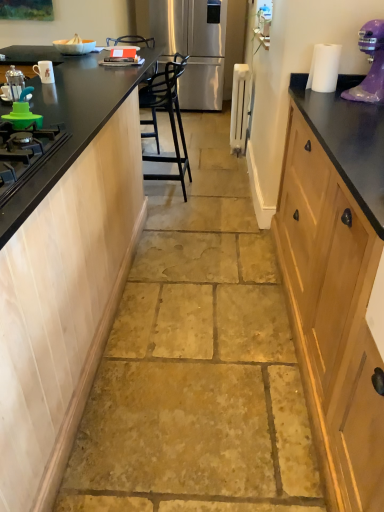
Question: From a real-world perspective, is black plastic chair at center over black matte countertop at left?

Choices:
 (A) yes
 (B) no

Answer: (A)

Question: From a real-world perspective, does black plastic chair at center sit lower than black matte countertop at left?

Choices:
 (A) yes
 (B) no

Answer: (B)

Question: Does black plastic chair at center lie in front of black matte countertop at left?

Choices:
 (A) no
 (B) yes

Answer: (B)

Question: Are black plastic chair at center and black matte countertop at left located far from each other?

Choices:
 (A) yes
 (B) no

Answer: (B)

Question: Does black plastic chair at center have a smaller size compared to black matte countertop at left?

Choices:
 (A) yes
 (B) no

Answer: (A)

Question: Is black plastic chair at center aimed at black matte countertop at left?

Choices:
 (A) yes
 (B) no

Answer: (B)

Question: Can white metallic radiator at center, the second appliance viewed from the front, be found inside black plastic chair at center?

Choices:
 (A) no
 (B) yes

Answer: (A)

Question: Can you confirm if black plastic chair at center is bigger than white metallic radiator at center, which is counted as the 2th appliance, starting from the bottom?

Choices:
 (A) no
 (B) yes

Answer: (B)

Question: Is black plastic chair at center thinner than white metallic radiator at center, which is counted as the first appliance, starting from the top?

Choices:
 (A) yes
 (B) no

Answer: (B)

Question: Is black plastic chair at center closer to camera compared to white metallic radiator at center, the 1th appliance in the back-to-front sequence?

Choices:
 (A) yes
 (B) no

Answer: (A)

Question: From a real-world perspective, does black plastic chair at center stand above white metallic radiator at center, which is counted as the 1th appliance, starting from the right?

Choices:
 (A) yes
 (B) no

Answer: (A)

Question: Is the depth of black plastic chair at center greater than that of white metallic radiator at center, acting as the second appliance starting from the left?

Choices:
 (A) no
 (B) yes

Answer: (A)

Question: Considering the relative positions of black plastic chair at center and white paper at upper right in the image provided, is black plastic chair at center to the right of white paper at upper right from the viewer's perspective?

Choices:
 (A) yes
 (B) no

Answer: (B)